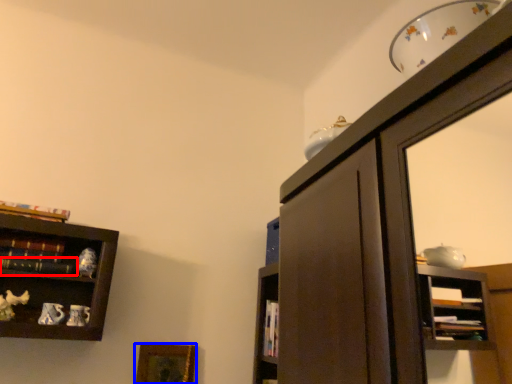
Question: Which object appears closest to the camera in this image, book (highlighted by a red box) or picture frame (highlighted by a blue box)?

Choices:
 (A) book
 (B) picture frame

Answer: (A)